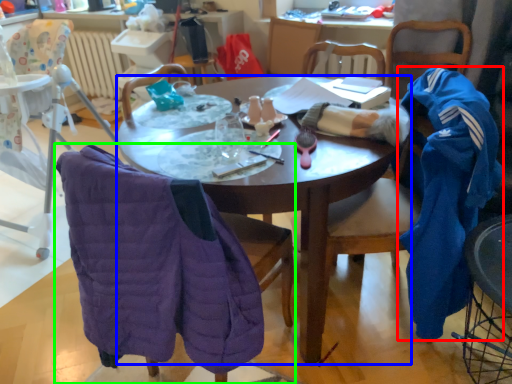
Question: Based on their relative distances, which object is nearer to clothing (highlighted by a red box)? Choose from desk (highlighted by a blue box) and chair (highlighted by a green box).

Choices:
 (A) desk
 (B) chair

Answer: (A)